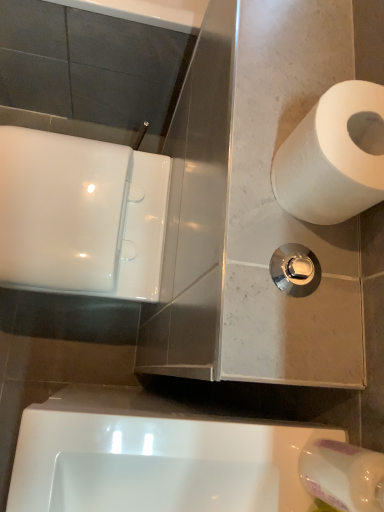
Find the location of a particular element. The height and width of the screenshot is (512, 384). free space to the back side of white paper at right, placed as the second toilet paper when sorted from bottom to top is located at coordinates (315, 53).